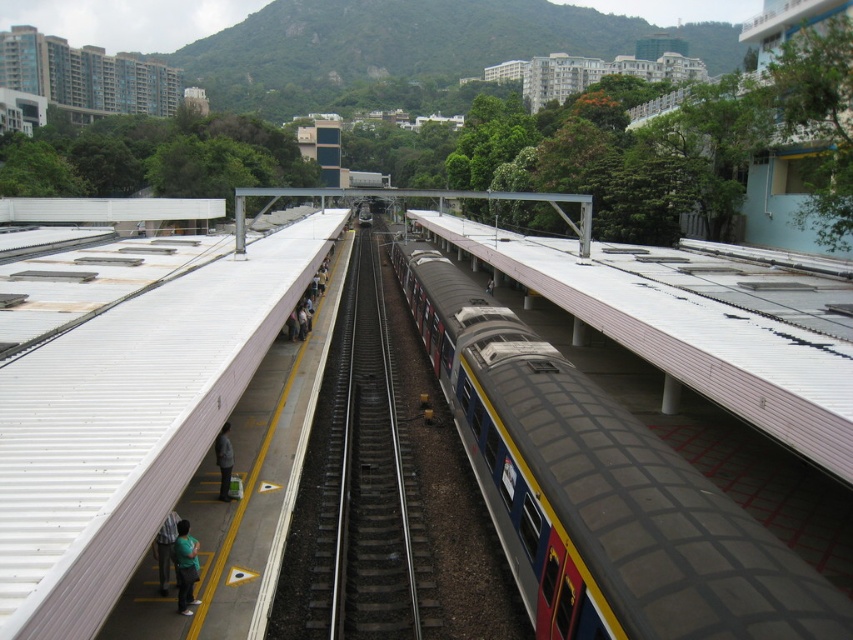
Question: Does silver metallic train at center have a larger size compared to green fabric shirt at lower left?

Choices:
 (A) no
 (B) yes

Answer: (B)

Question: Is metallic gray train at center to the right of silver metallic train at center from the viewer's perspective?

Choices:
 (A) yes
 (B) no

Answer: (A)

Question: Estimate the real-world distances between objects in this image. Which object is farther from the green fabric shirt at left?

Choices:
 (A) green fabric shirt at lower left
 (B) metallic gray train at center
 (C) black metal train track at center
 (D) silver metallic train at center

Answer: (B)

Question: Among these objects, which one is farthest from the camera?

Choices:
 (A) green fabric shirt at lower left
 (B) white corrugated metal platform at center

Answer: (A)

Question: Can you confirm if metallic gray train at center is positioned below dark gray jacket at lower left?

Choices:
 (A) no
 (B) yes

Answer: (A)

Question: Which object appears closest to the camera in this image?

Choices:
 (A) metallic gray train at center
 (B) green fabric shirt at left
 (C) black metal train track at center
 (D) dark gray jacket at lower left

Answer: (A)